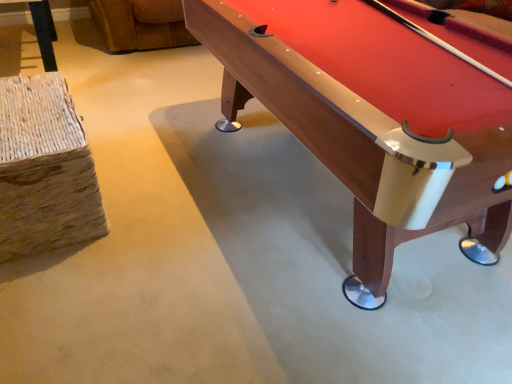
Question: Considering the positions of point (305, 134) and point (56, 163), is point (305, 134) closer or farther from the camera than point (56, 163)?

Choices:
 (A) closer
 (B) farther

Answer: (A)

Question: Relative to woven straw stool at left, is wooden pool table at right in front or behind?

Choices:
 (A) behind
 (B) front

Answer: (B)

Question: Is wooden pool table at right wider or thinner than woven straw stool at left?

Choices:
 (A) thin
 (B) wide

Answer: (B)

Question: Visually, is woven straw stool at left positioned to the left or to the right of wooden pool table at right?

Choices:
 (A) right
 (B) left

Answer: (B)

Question: From the image's perspective, is woven straw stool at left located above or below wooden pool table at right?

Choices:
 (A) above
 (B) below

Answer: (B)

Question: From a real-world perspective, is woven straw stool at left above or below wooden pool table at right?

Choices:
 (A) above
 (B) below

Answer: (B)

Question: Looking at the image, does woven straw stool at left seem bigger or smaller compared to wooden pool table at right?

Choices:
 (A) big
 (B) small

Answer: (B)